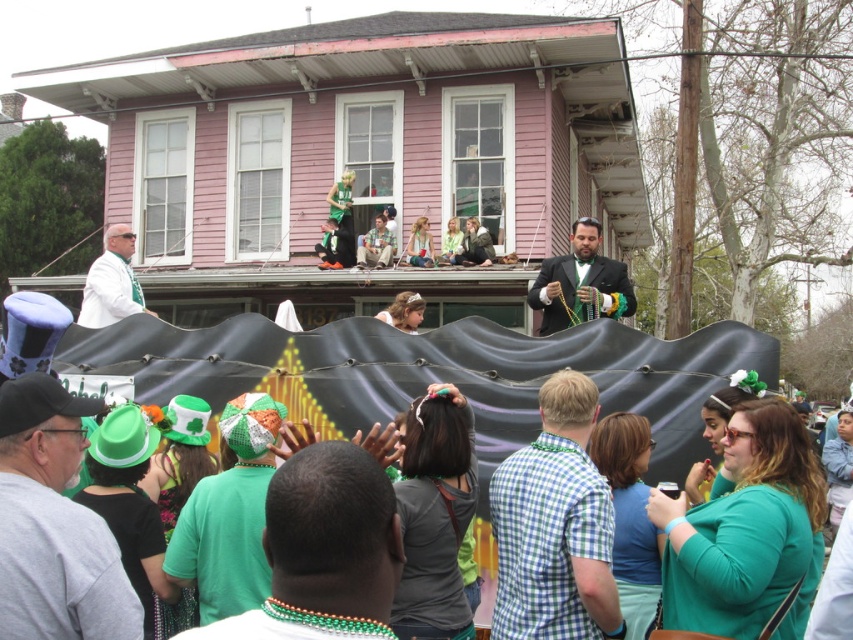
Between green felt hat at lower left and matte green hat at center, which one has more height?

green felt hat at lower left is taller.

Can you confirm if green felt hat at lower left is thinner than matte green hat at center?

No.

Does point (24, 632) lie in front of point (370, 241)?

Yes, point (24, 632) is closer to viewer.

Find the location of a particular element. This screenshot has height=640, width=853. green felt hat at lower left is located at coordinates (54, 524).

Is point (389, 628) positioned behind point (242, 602)?

No, (389, 628) is closer to viewer.

Is point (287, 637) less distant than point (223, 524)?

Yes.

Where is `green matte shirt at lower center`? green matte shirt at lower center is located at coordinates (323, 550).

Is the position of green matte shirt at lower center more distant than that of teal matte shirt at lower right?

No, green matte shirt at lower center is closer to the viewer.

This screenshot has height=640, width=853. I want to click on green matte shirt at lower center, so click(x=323, y=550).

The height and width of the screenshot is (640, 853). I want to click on green matte shirt at lower center, so click(x=323, y=550).